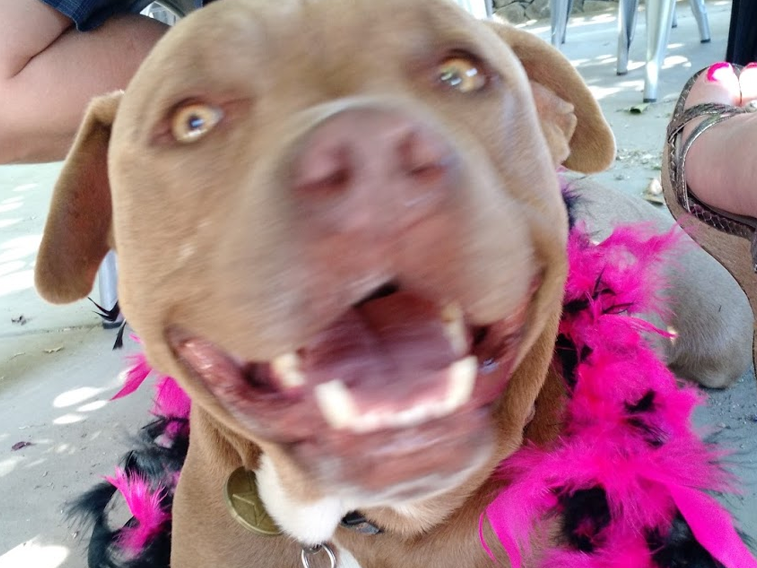
Image resolution: width=757 pixels, height=568 pixels. What are the coordinates of `chair leg` in the screenshot? It's located at (650, 58), (549, 19), (624, 18), (696, 19).